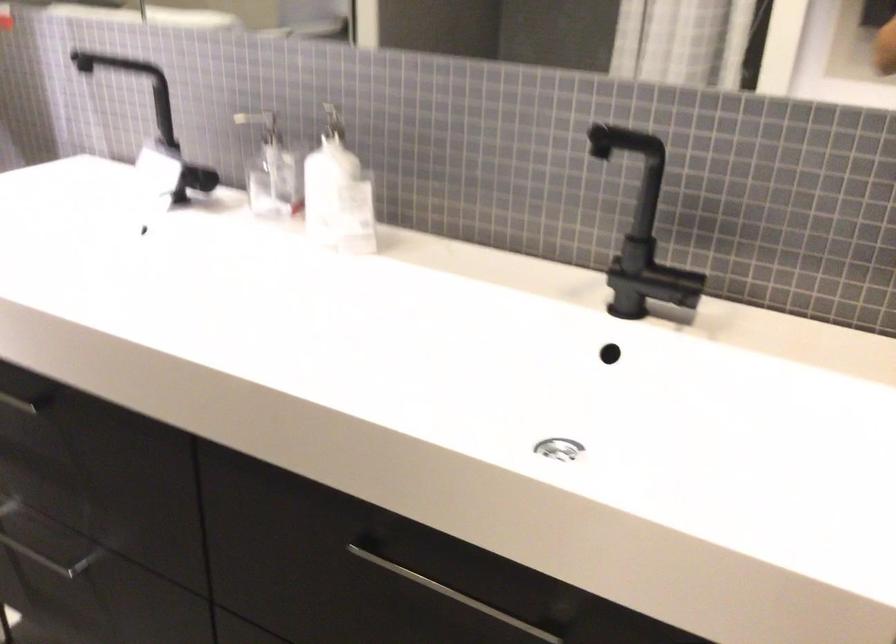
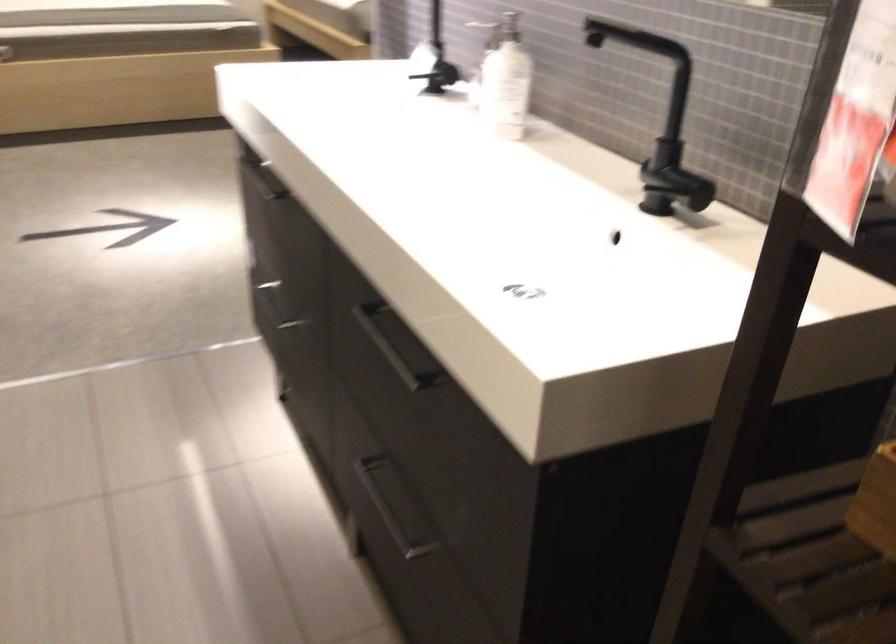
In the second image, find the point that corresponds to point 259,91 in the first image.

(503, 8)